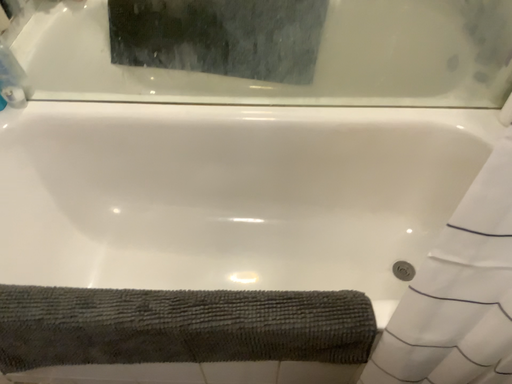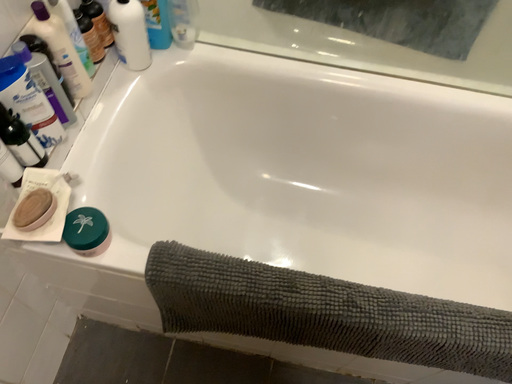
Question: How did the camera likely rotate when shooting the video?

Choices:
 (A) rotated upward
 (B) rotated downward

Answer: (B)